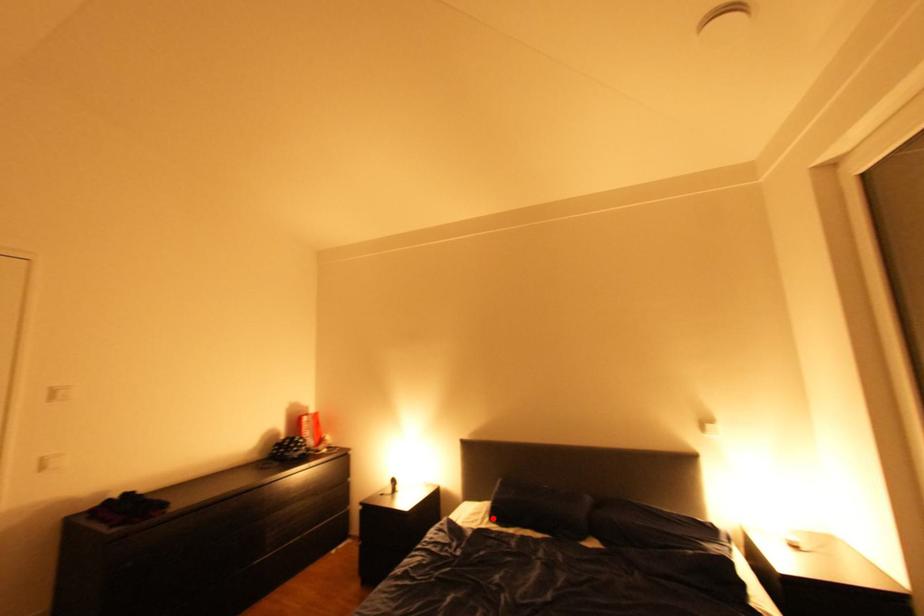
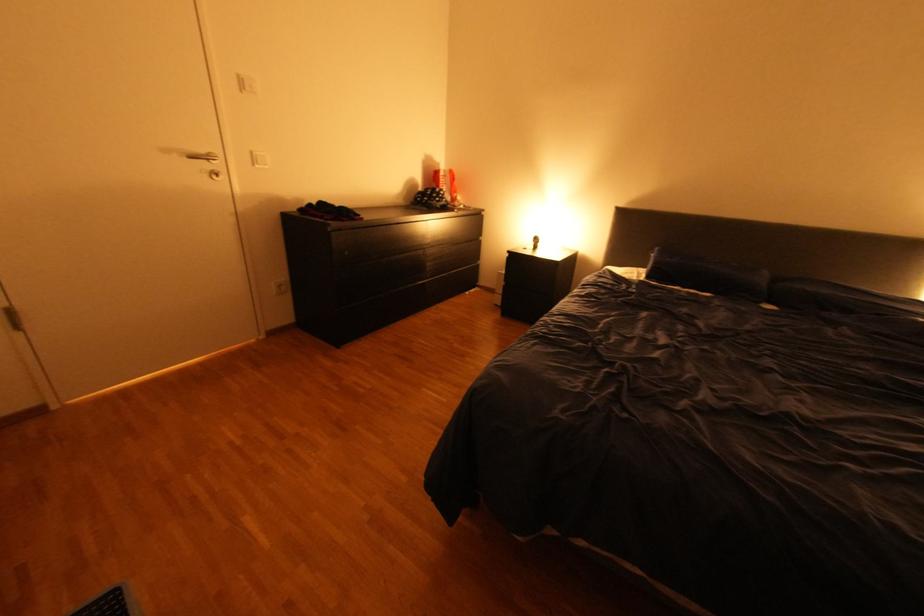
Find the pixel in the second image that matches the highlighted location in the first image.

(648, 277)